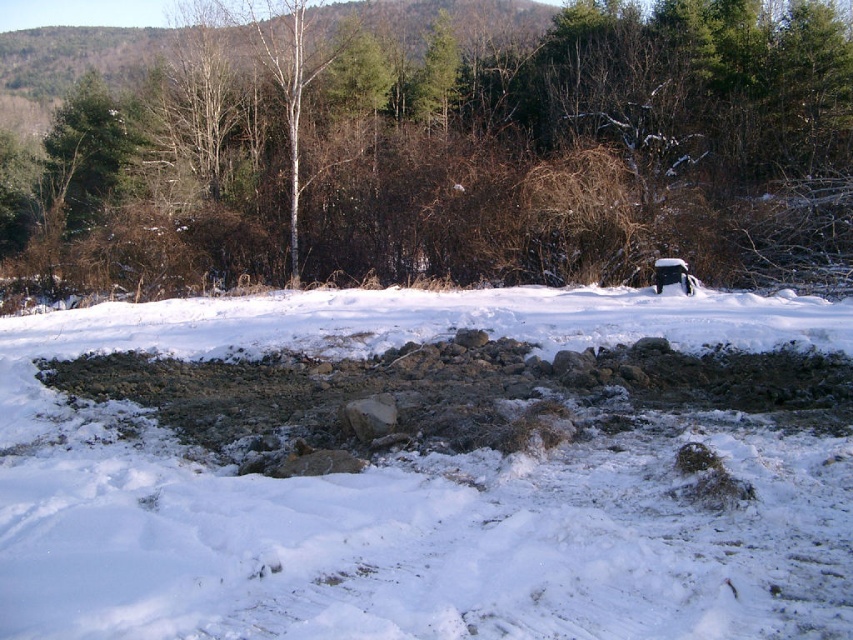
Looking at this image, you are standing in the snowy landscape and see two points marked in the image. Which point is closer to you, point (51,448) or point (418,436)?

Point (51,448) is closer to you because it is further to the viewer than point (418,436).

Based on the scene description, where is the white powdery snow at center located in the image?

The white powdery snow at center is located at point coordinates of (415,492).

You are a delivery robot with a maximum travel distance of 25 meters. You need to deliver a package from the damp gray mud at center to the green matte tree at upper left. Can you complete the delivery without exceeding your range?

The distance between damp gray mud at center and green matte tree at upper left is 27.43 meters, which exceeds the robot s 25 meter range. The delivery cannot be completed without exceeding the range.